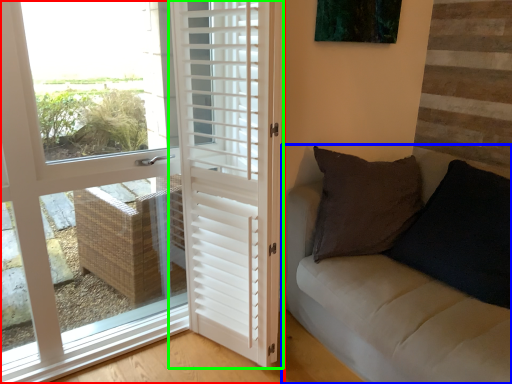
Question: Which object is the farthest from door (highlighted by a red box)? Choose among these: studio couch (highlighted by a blue box) or door (highlighted by a green box).

Choices:
 (A) studio couch
 (B) door

Answer: (A)